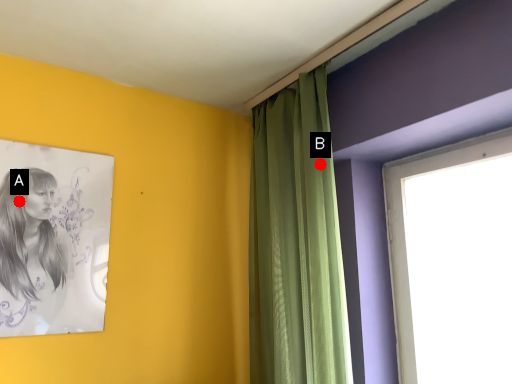
Question: Two points are circled on the image, labeled by A and B beside each circle. Which point is closer to the camera taking this photo?

Choices:
 (A) A is closer
 (B) B is closer

Answer: (A)